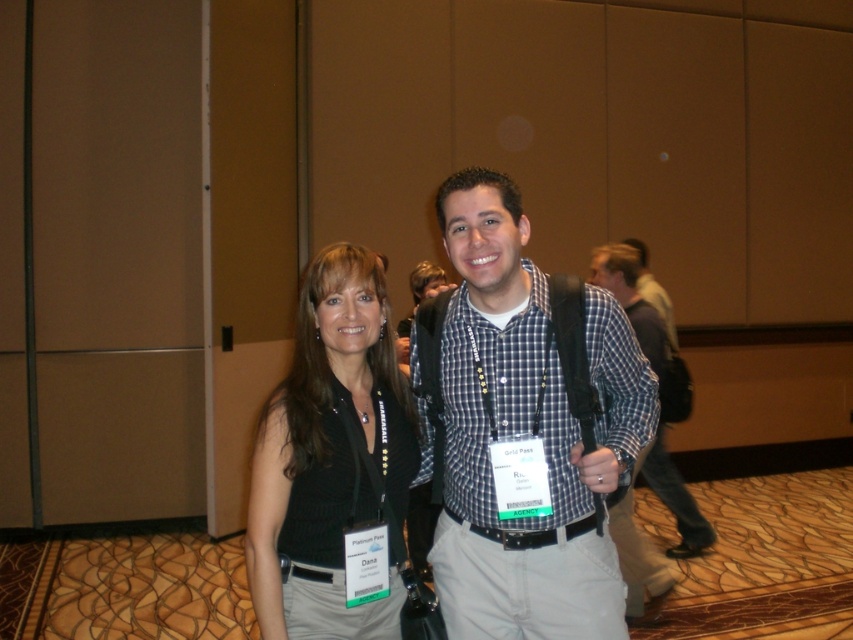
Question: Which of the following is the closest to the observer?

Choices:
 (A) black knitted vest at center
 (B) plaid fabric shirt at center
 (C) checkered fabric shirt at center

Answer: (C)

Question: Can you confirm if black knitted vest at center is positioned above plaid fabric shirt at center?

Choices:
 (A) yes
 (B) no

Answer: (B)

Question: Does checkered fabric shirt at center appear on the right side of black knitted vest at center?

Choices:
 (A) yes
 (B) no

Answer: (A)

Question: Which object appears farthest from the camera in this image?

Choices:
 (A) black knitted vest at center
 (B) checkered fabric shirt at center

Answer: (A)

Question: Which object is farther from the camera taking this photo?

Choices:
 (A) plaid fabric shirt at center
 (B) checkered fabric shirt at center

Answer: (A)

Question: Does checkered fabric shirt at center have a greater width compared to black knitted vest at center?

Choices:
 (A) yes
 (B) no

Answer: (A)